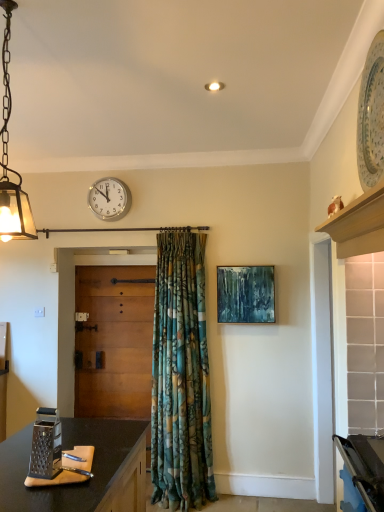
Find the location of `empty space that is ontop of wooden door at center`. empty space that is ontop of wooden door at center is located at coordinates (117, 268).